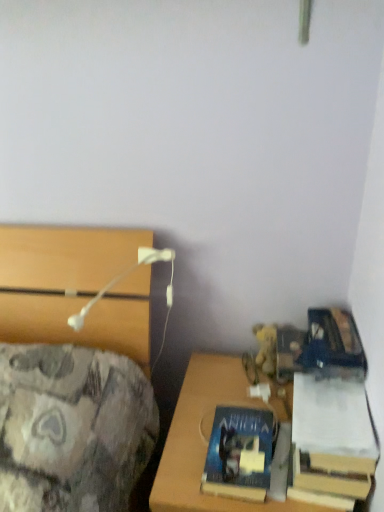
In order to click on free space above wooden desk at lower right (from a real-world perspective) in this screenshot , I will do pyautogui.click(x=244, y=418).